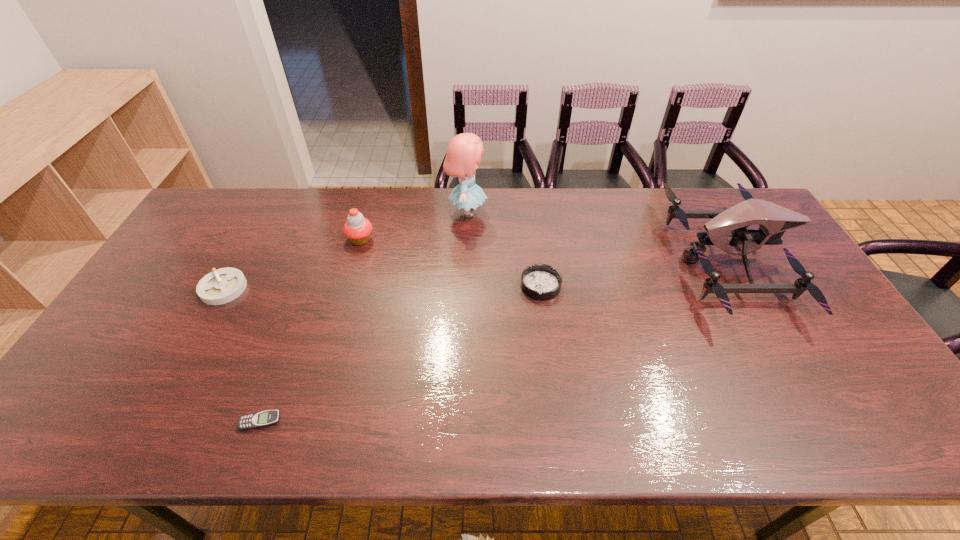
In the image, there is a desktop. Identify the location of free space at the far right corner. This screenshot has width=960, height=540. tap(723, 206).

Find the location of `empty location between the drone and the leftmost object`. empty location between the drone and the leftmost object is located at coordinates (476, 274).

I want to click on empty space that is in between the nearest object and the doll, so click(x=364, y=317).

I want to click on empty space that is in between the nearest object and the rightmost object, so click(495, 341).

At what (x,y) coordinates should I click in order to perform the action: click on empty space that is in between the shortest object and the fifth shortest object. Please return your answer as a coordinate pair (x, y). The width and height of the screenshot is (960, 540). Looking at the image, I should click on (495, 341).

Find the location of `vacant space that is in between the left ashtray and the drone`. vacant space that is in between the left ashtray and the drone is located at coordinates (476, 274).

Locate an element on the screen. vacant area that lies between the second tallest object and the shortest object is located at coordinates (495, 341).

Where is `vacant area between the shortest object and the cupcake`? Image resolution: width=960 pixels, height=540 pixels. vacant area between the shortest object and the cupcake is located at coordinates (310, 330).

Locate an element on the screen. free space between the third object from right to left and the fifth object from left to right is located at coordinates coord(504,249).

Where is `free space between the fifth object from left to right and the second tallest object`? free space between the fifth object from left to right and the second tallest object is located at coordinates (636, 273).